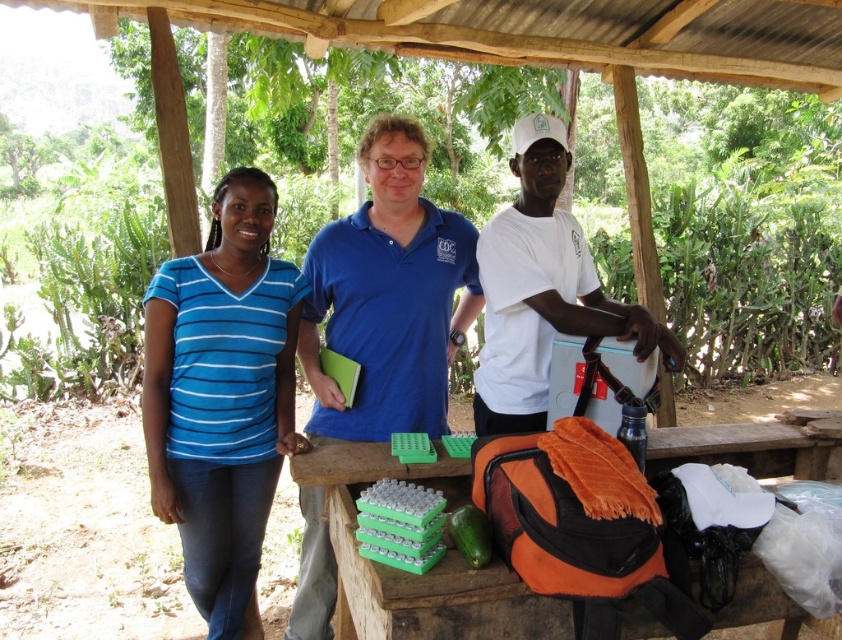
You are a photographer setting up a tripod to take a group photo of the blue striped shirt at left and the blue cotton shirt at center. If you want to ensure both subjects are in focus and at the same height in the photo, which subject should you adjust the tripod height to match?

The blue striped shirt at left is shorter than the blue cotton shirt at center, so you should adjust the tripod height to match the blue striped shirt at left to ensure both are in focus and at the same height.

You are standing in front of the wooden shelter and want to place a small potted plant between the two points marked as point (214, 285) and point (435, 568). Which point should the plant be closer to in order to be nearer to the viewer?

The plant should be closer to point (214, 285) because it is further to the viewer than point (435, 568).

You are a photographer trying to capture a group photo of the blue striped shirt at left and the white matte shirt at center. Since you want to ensure both are in the frame, which direction should you position yourself relative to the subjects?

You should position yourself to the right of the subjects because the blue striped shirt at left is to the left of the white matte shirt at center, so standing to the right would allow both to be captured in the frame without being cut off.